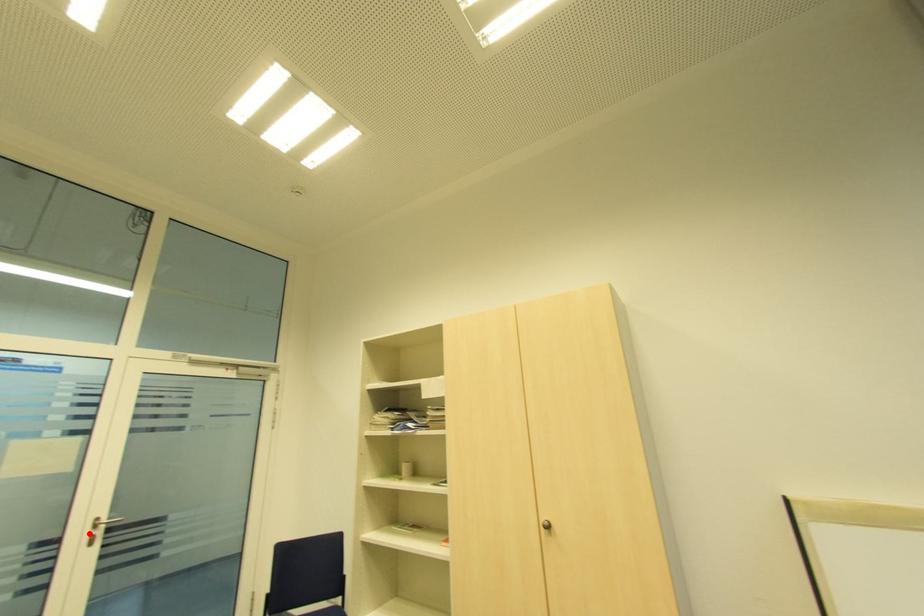
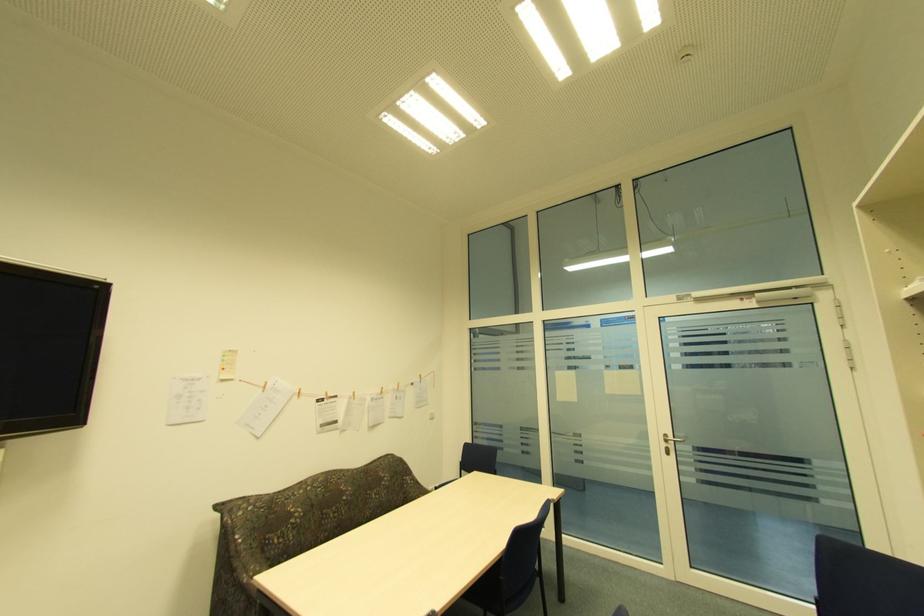
The point at the highlighted location is marked in the first image. Where is the corresponding point in the second image?

(666, 445)